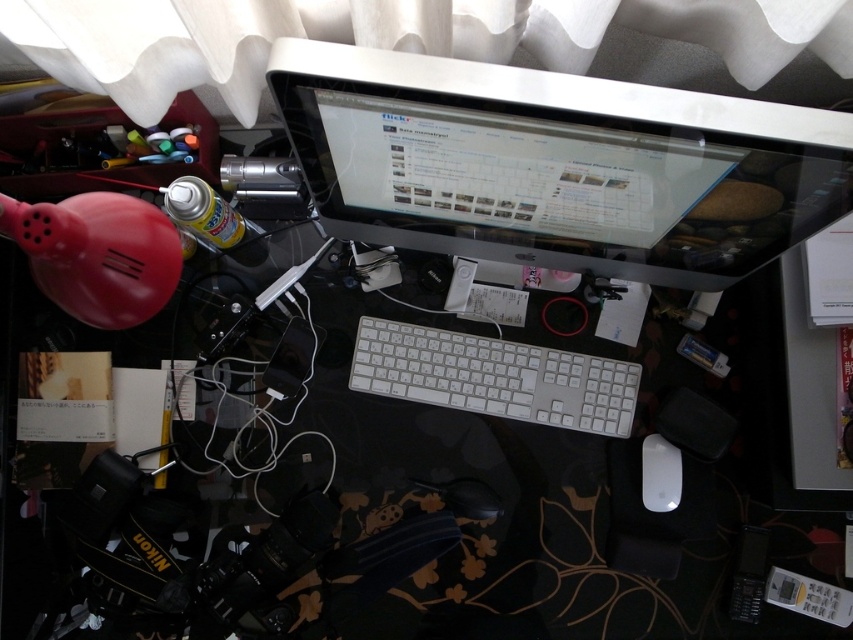
You are organizing a desk and need to place a new item between the sleek silver monitor at upper center and the white matte mouse at lower right. Given their sizes, which one requires more desk space?

The sleek silver monitor at upper center requires more desk space because it is larger than the white matte mouse at lower right.

You need to place a small sticker on the larger of the two devices, the white plastic keyboard at center and the white matte mouse at lower right. Which device should you choose?

The white plastic keyboard at center is bigger than the white matte mouse at lower right, so you should place the sticker on the white plastic keyboard at center.

You are trying to locate the sleek silver monitor at upper center in the workspace. According to the coordinates provided, where exactly is it positioned?

The sleek silver monitor at upper center is located at the coordinates point [556,164].